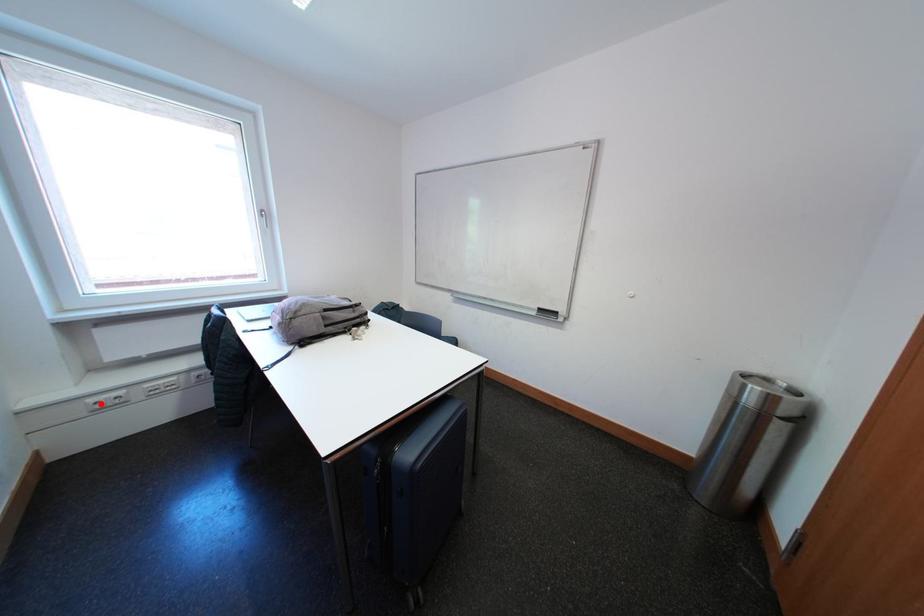
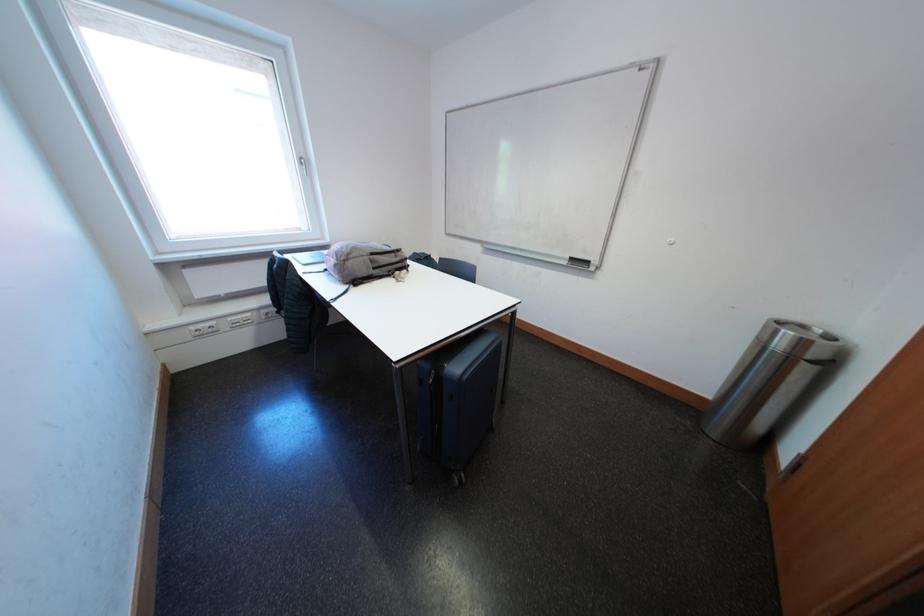
Question: I am providing you with two images of the same scene from different viewpoints. In image1, a red point is highlighted. Considering the same 3D point in image2, which of the following is correct?

Choices:
 (A) It is closer
 (B) It is farther

Answer: (A)